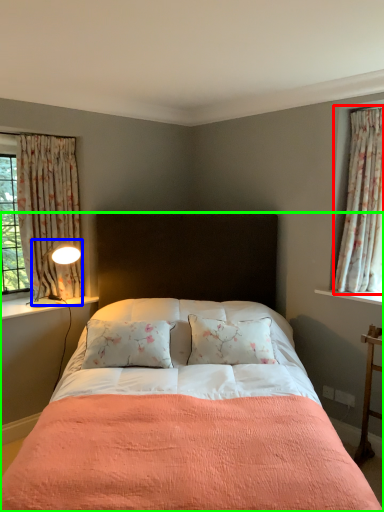
Question: Which object is the farthest from curtain (highlighted by a red box)? Choose among these: light fixture (highlighted by a blue box) or bed (highlighted by a green box).

Choices:
 (A) light fixture
 (B) bed

Answer: (A)